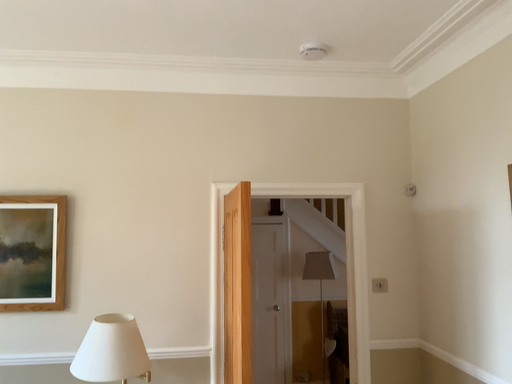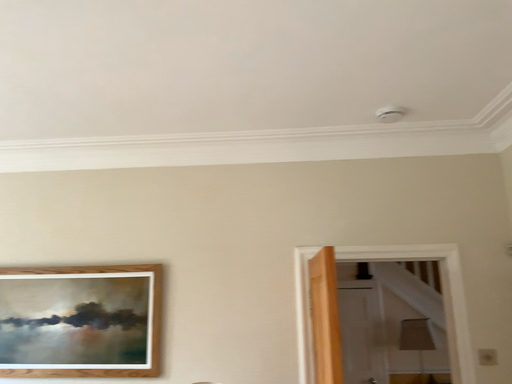
Question: Which way did the camera rotate in the video?

Choices:
 (A) rotated left
 (B) rotated right

Answer: (A)